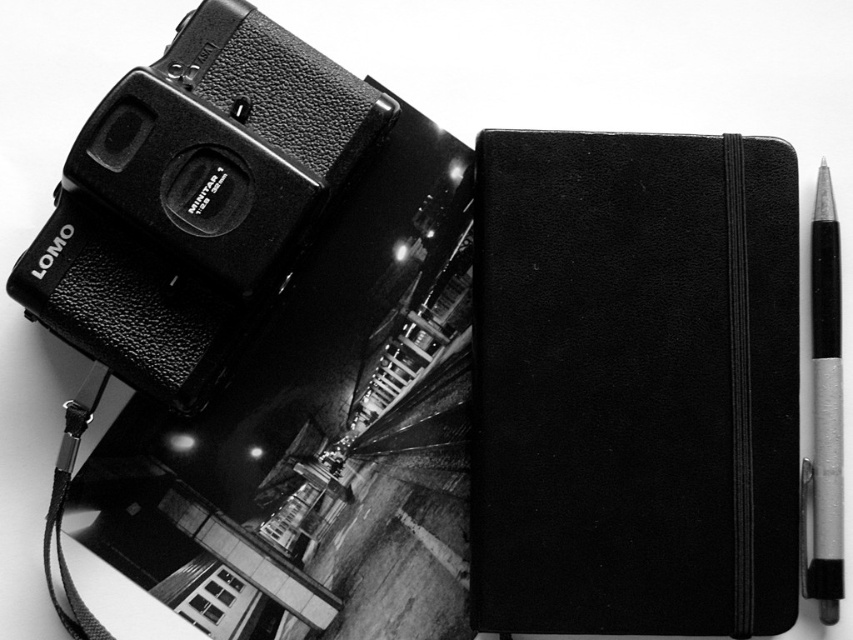
Question: Which point is closer to the camera?

Choices:
 (A) metallic silver pen at right
 (B) rubberized black camera at upper left

Answer: (B)

Question: Does black leather notebook at center appear on the right side of metallic silver pen at right?

Choices:
 (A) yes
 (B) no

Answer: (B)

Question: Does black leather notebook at center have a greater width compared to rubberized black camera at upper left?

Choices:
 (A) no
 (B) yes

Answer: (A)

Question: Which object appears closest to the camera in this image?

Choices:
 (A) metallic silver pen at right
 (B) rubberized black camera at upper left
 (C) black leather notebook at center

Answer: (B)

Question: Is rubberized black camera at upper left above metallic silver pen at right?

Choices:
 (A) no
 (B) yes

Answer: (B)

Question: Estimate the real-world distances between objects in this image. Which object is closer to the metallic silver pen at right?

Choices:
 (A) rubberized black camera at upper left
 (B) black leather notebook at center

Answer: (B)